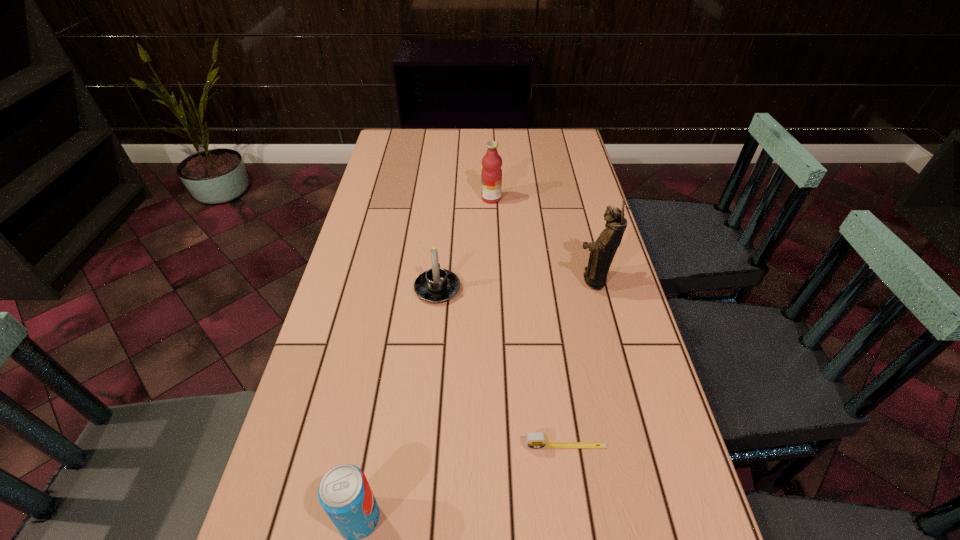
Find the location of `vacant space located 0.090m on the label of the third object from right to left`. vacant space located 0.090m on the label of the third object from right to left is located at coordinates (454, 198).

You are a GUI agent. You are given a task and a screenshot of the screen. Output one action in this format:
    pyautogui.click(x=<x>, y=<y>)
    Task: Click on the free region located on the label of the third object from right to left
    Image resolution: width=960 pixels, height=540 pixels.
    Given the screenshot: What is the action you would take?
    pyautogui.click(x=372, y=198)

I want to click on blank space located 0.200m on the label of the third object from right to left, so click(421, 198).

The image size is (960, 540). Identify the location of free space located 0.070m with a handle on the side of the candle holder. (441, 256).

You are a GUI agent. You are given a task and a screenshot of the screen. Output one action in this format:
    pyautogui.click(x=<x>, y=<y>)
    Task: Click on the free region located with a handle on the side of the candle holder
    The image size is (960, 540).
    Given the screenshot: What is the action you would take?
    pyautogui.click(x=445, y=200)

Find the location of a particular element. vacant point located with a handle on the side of the candle holder is located at coordinates (441, 251).

Image resolution: width=960 pixels, height=540 pixels. What are the coordinates of `vacant area situated 0.060m at the front of the shortest object with the tape extended` in the screenshot? It's located at (570, 481).

Where is `figurine situated at the right edge`? This screenshot has width=960, height=540. figurine situated at the right edge is located at coordinates (603, 250).

In order to click on tape measure that is positioned at the right edge in this screenshot , I will do `click(537, 440)`.

At what (x,y) coordinates should I click in order to perform the action: click on free space at the far edge of the desktop. Please return your answer as a coordinate pair (x, y). Image resolution: width=960 pixels, height=540 pixels. Looking at the image, I should click on (429, 136).